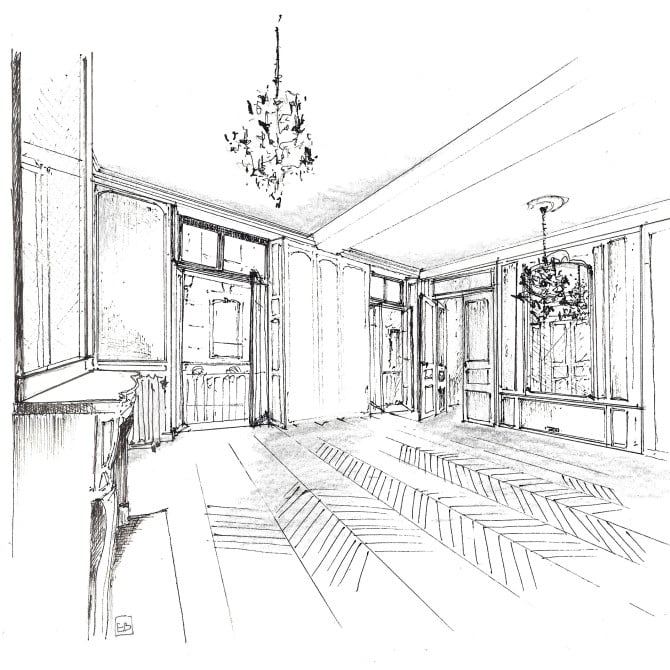
Where is `window`? Image resolution: width=670 pixels, height=670 pixels. window is located at coordinates pyautogui.click(x=573, y=356).